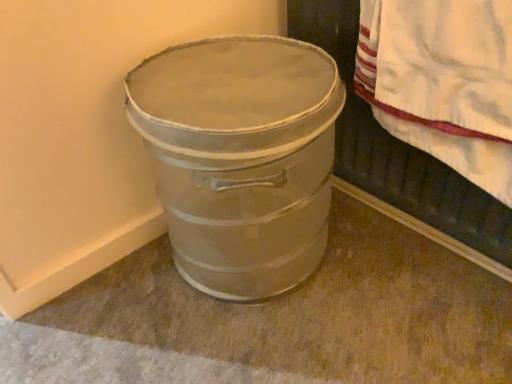
Question: Is white textured towel at upper right thinner than metallic silver bucket at lower left?

Choices:
 (A) yes
 (B) no

Answer: (A)

Question: From a real-world perspective, does white textured towel at upper right sit lower than metallic silver bucket at lower left?

Choices:
 (A) no
 (B) yes

Answer: (A)

Question: From the image's perspective, is white textured towel at upper right on top of metallic silver bucket at lower left?

Choices:
 (A) yes
 (B) no

Answer: (A)

Question: Is white textured towel at upper right located outside metallic silver bucket at lower left?

Choices:
 (A) yes
 (B) no

Answer: (A)

Question: From a real-world perspective, is white textured towel at upper right over metallic silver bucket at lower left?

Choices:
 (A) no
 (B) yes

Answer: (B)

Question: Considering the positions of white textured towel at upper right and metallic gray bucket at lower left in the image, is white textured towel at upper right wider or thinner than metallic gray bucket at lower left?

Choices:
 (A) wide
 (B) thin

Answer: (B)

Question: Is point (450, 69) positioned closer to the camera than point (189, 99)?

Choices:
 (A) farther
 (B) closer

Answer: (B)

Question: Considering the relative positions of white textured towel at upper right and metallic gray bucket at lower left in the image provided, is white textured towel at upper right to the left or to the right of metallic gray bucket at lower left?

Choices:
 (A) right
 (B) left

Answer: (A)

Question: Would you say white textured towel at upper right is inside or outside metallic gray bucket at lower left?

Choices:
 (A) outside
 (B) inside

Answer: (A)

Question: Considering the positions of metallic gray bucket at lower left and white textured towel at upper right in the image, is metallic gray bucket at lower left taller or shorter than white textured towel at upper right?

Choices:
 (A) short
 (B) tall

Answer: (B)

Question: Does point (216, 43) appear closer or farther from the camera than point (418, 54)?

Choices:
 (A) farther
 (B) closer

Answer: (A)

Question: Is metallic gray bucket at lower left wider or thinner than white textured towel at upper right?

Choices:
 (A) thin
 (B) wide

Answer: (B)

Question: Is metallic gray bucket at lower left situated inside white textured towel at upper right or outside?

Choices:
 (A) inside
 (B) outside

Answer: (B)

Question: From the image's perspective, is metallic silver bucket at lower left located above or below metallic gray bucket at lower left?

Choices:
 (A) above
 (B) below

Answer: (B)

Question: Considering the positions of point (163, 243) and point (200, 284), is point (163, 243) closer or farther from the camera than point (200, 284)?

Choices:
 (A) closer
 (B) farther

Answer: (B)